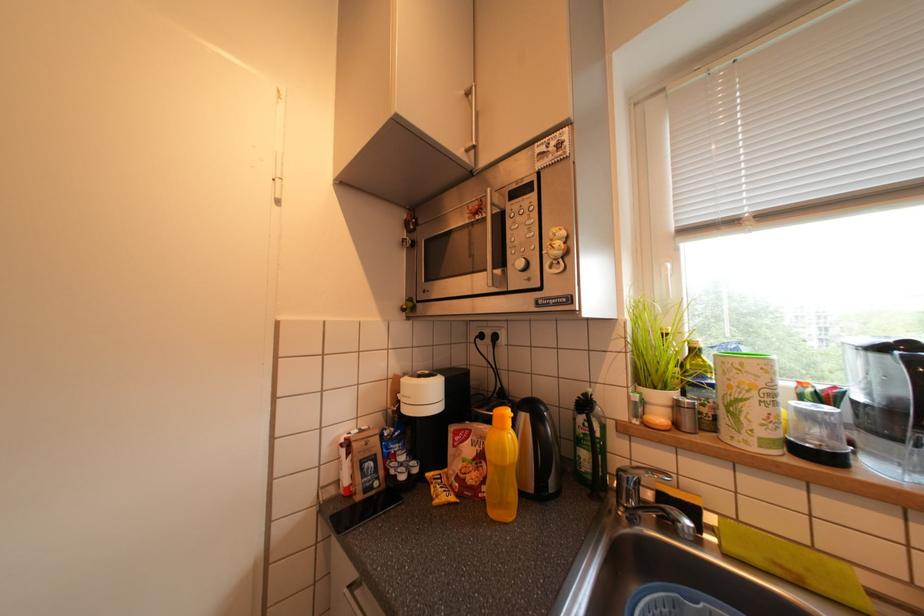
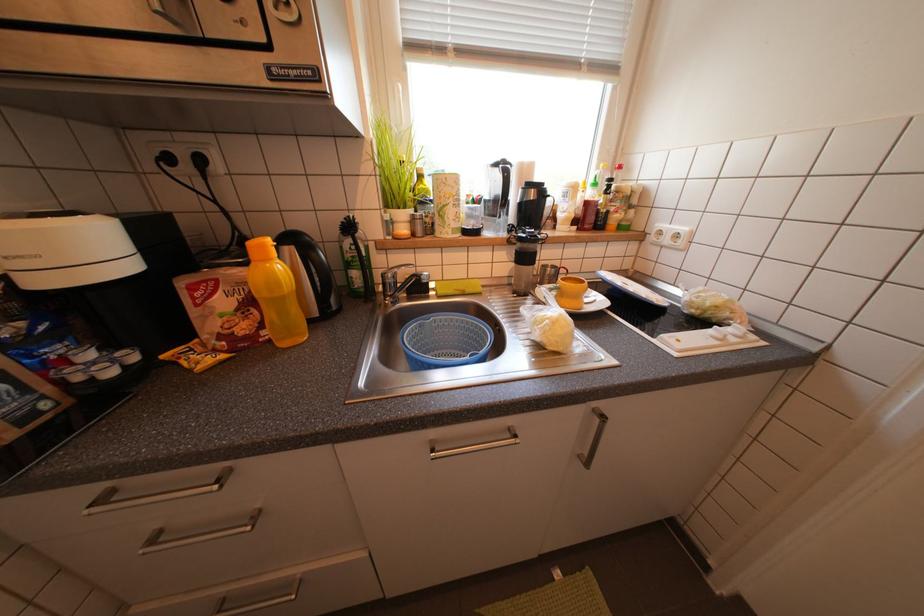
The images are taken continuously from a first-person perspective. In which direction is your viewpoint rotating?

The camera rotated toward right-down.